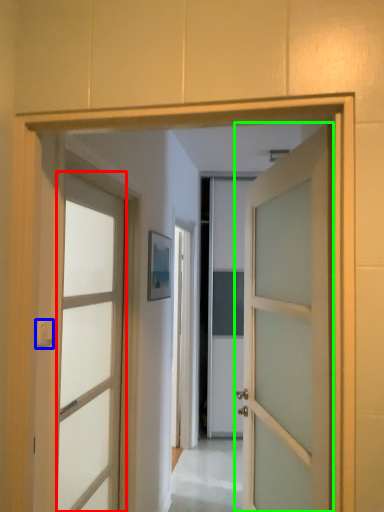
Question: Based on their relative distances, which object is nearer to door (highlighted by a red box)? Choose from door handle (highlighted by a blue box) and door (highlighted by a green box).

Choices:
 (A) door handle
 (B) door

Answer: (A)